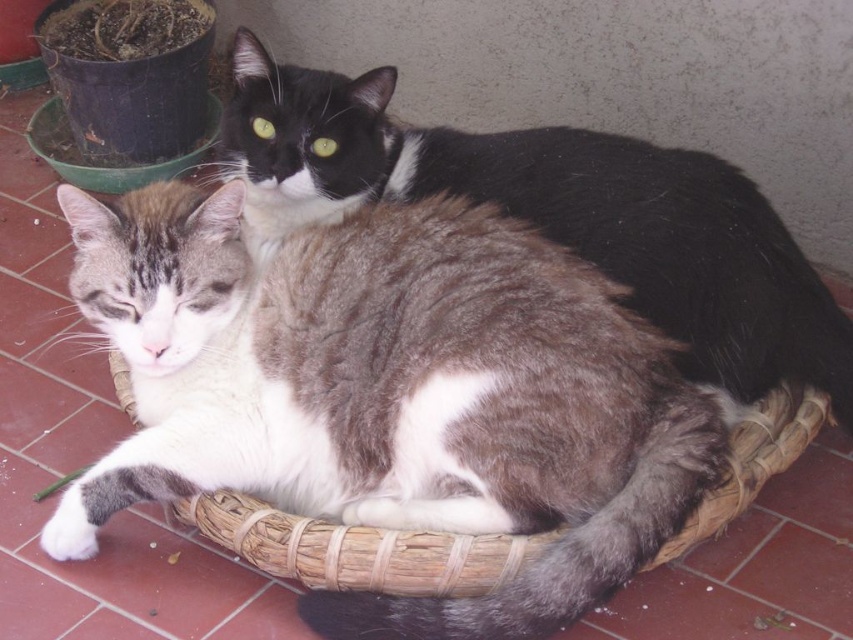
Is gray and white fur cat at center to the right of woven straw basket at center from the viewer's perspective?

Indeed, gray and white fur cat at center is positioned on the right side of woven straw basket at center.

Which of these two, gray and white fur cat at center or woven straw basket at center, stands shorter?

Standing shorter between the two is woven straw basket at center.

Is point (364, 129) positioned behind point (415, 593)?

Yes, it is.

This screenshot has width=853, height=640. Identify the location of gray and white fur cat at center. (556, 212).

Does gray-white fur cat at center lie behind gray and white fur cat at center?

No, gray-white fur cat at center is in front of gray and white fur cat at center.

Between gray-white fur cat at center and gray and white fur cat at center, which one is positioned lower?

gray-white fur cat at center

Image resolution: width=853 pixels, height=640 pixels. What are the coordinates of `gray-white fur cat at center` in the screenshot? It's located at (390, 394).

I want to click on gray-white fur cat at center, so click(x=390, y=394).

Who is lower down, gray-white fur cat at center or woven straw basket at center?

Positioned lower is woven straw basket at center.

Is point (401, 214) more distant than point (308, 518)?

Yes, it is behind point (308, 518).

Is point (529, 337) positioned behind point (456, 572)?

That is True.

The height and width of the screenshot is (640, 853). Find the location of `gray-white fur cat at center`. gray-white fur cat at center is located at coordinates (390, 394).